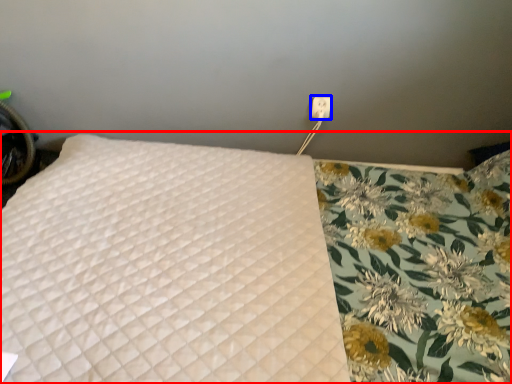
Question: Which object is closer to the camera taking this photo, bed (highlighted by a red box) or electric outlet (highlighted by a blue box)?

Choices:
 (A) bed
 (B) electric outlet

Answer: (A)